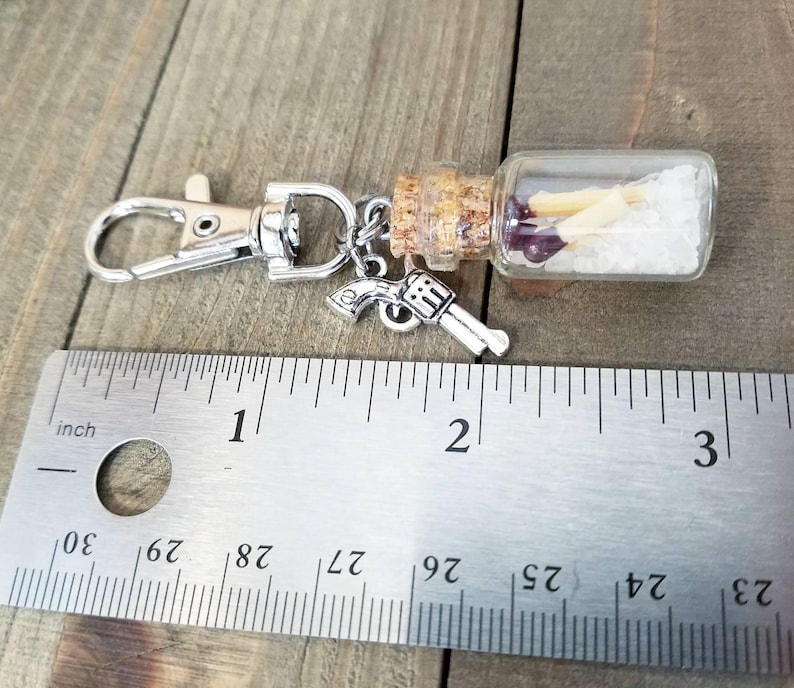
Identify the location of jar. This screenshot has height=688, width=794. (592, 265).